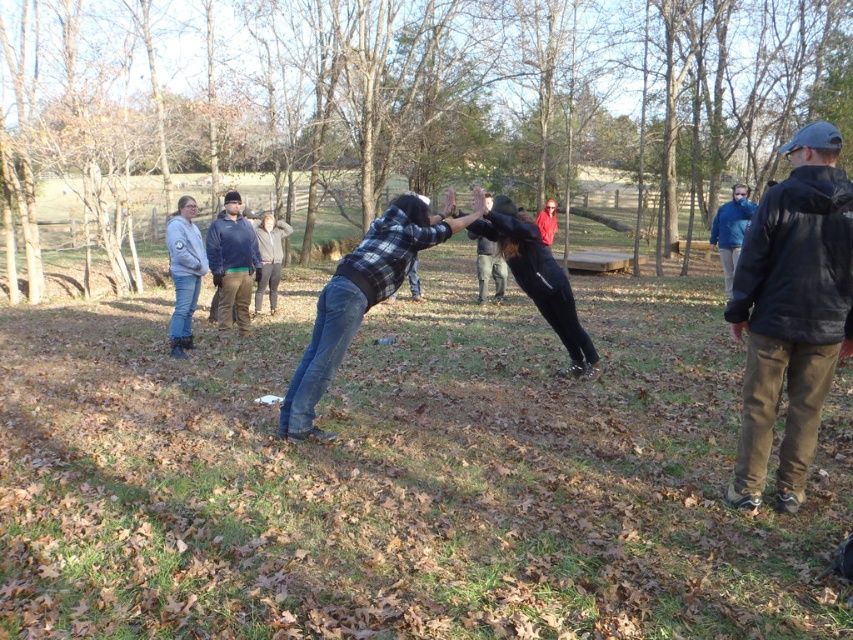
Question: Can you confirm if flannel shirt at center is positioned below black flannel shirt at center?

Choices:
 (A) no
 (B) yes

Answer: (B)

Question: Is blue fleece jacket at upper right wider than red matte jacket at center?

Choices:
 (A) yes
 (B) no

Answer: (B)

Question: Considering the relative positions of flannel shirt at center and red matte jacket at center in the image provided, where is flannel shirt at center located with respect to red matte jacket at center?

Choices:
 (A) below
 (B) above

Answer: (A)

Question: Which object is positioned farthest from the dark blue fleece jacket at center?

Choices:
 (A) blue fleece jacket at upper right
 (B) black leather jacket at right

Answer: (A)

Question: Which of these objects is positioned farthest from the black matte pants at center?

Choices:
 (A) dark blue fleece jacket at center
 (B) black flannel shirt at center

Answer: (A)

Question: Which of the following is the farthest from the observer?

Choices:
 (A) light gray fleece jacket at left
 (B) flannel shirt at center
 (C) black leather jacket at right

Answer: (A)